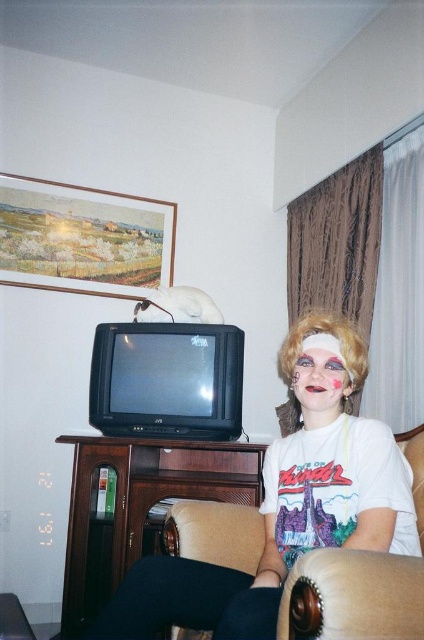
From the picture: You are a makeup artist observing the scene. You need to place a new product between the blonde synthetic wig at center and the matte pink makeup at center. Based on their current positions, where should you place the new product?

Since the blonde synthetic wig at center is to the right of the matte pink makeup at center, you should place the new product between them, to the left of the blonde synthetic wig at center and to the right of the matte pink makeup at center.

You are a makeup artist preparing for a photoshoot and need to place both the blonde synthetic wig at center and the matte pink makeup at center on a shelf. If the shelf has limited space and you can only fit one item, which item should you choose based on their sizes?

The blonde synthetic wig at center has a larger size compared to the matte pink makeup at center, so you should choose the blonde synthetic wig at center to fit on the shelf since it takes up more space.